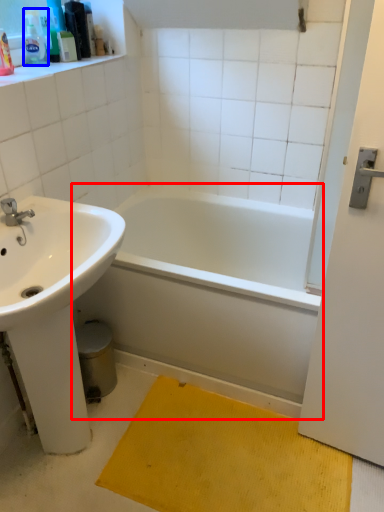
Question: Which of the following is the farthest to the observer, bathtub (highlighted by a red box) or toiletry (highlighted by a blue box)?

Choices:
 (A) bathtub
 (B) toiletry

Answer: (B)